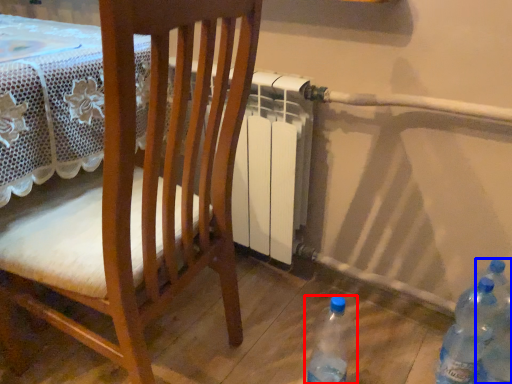
Question: Which of the following is the farthest to the observer, bottle (highlighted by a red box) or bottle (highlighted by a blue box)?

Choices:
 (A) bottle
 (B) bottle

Answer: (A)